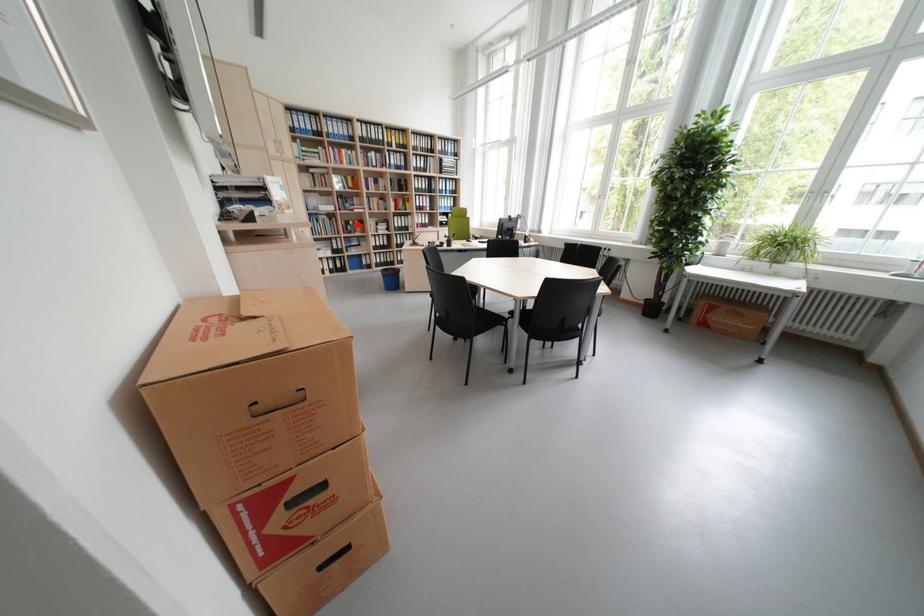
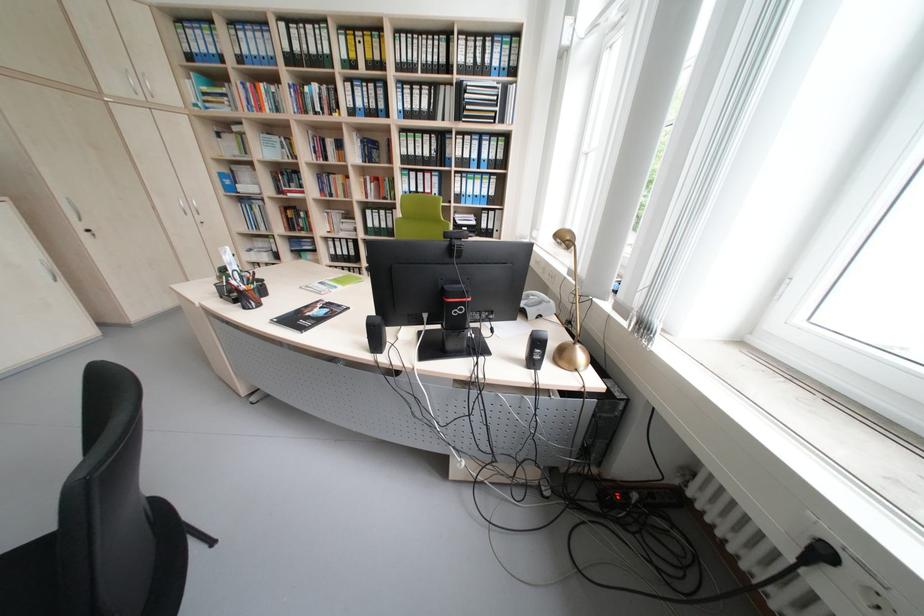
Locate, in the second image, the point that corresponds to the highlighted location in the first image.

(309, 217)